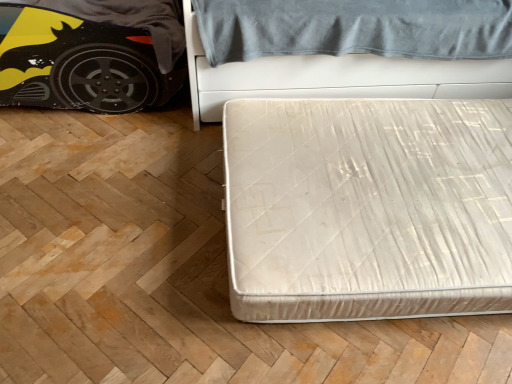
Question: Is white fabric mattress at lower right, which is the second bed in top-to-bottom order, positioned beyond the bounds of matt black car at left?

Choices:
 (A) yes
 (B) no

Answer: (A)

Question: From a real-world perspective, is white fabric mattress at lower right, acting as the 1th bed starting from the bottom, physically above matt black car at left?

Choices:
 (A) yes
 (B) no

Answer: (B)

Question: Does white fabric mattress at lower right, acting as the 1th bed starting from the bottom, have a smaller size compared to matt black car at left?

Choices:
 (A) yes
 (B) no

Answer: (A)

Question: Can you confirm if white fabric mattress at lower right, acting as the 1th bed starting from the bottom, is bigger than matt black car at left?

Choices:
 (A) no
 (B) yes

Answer: (A)

Question: Considering the relative positions of white fabric mattress at lower right, acting as the 1th bed starting from the bottom, and matt black car at left in the image provided, is white fabric mattress at lower right, acting as the 1th bed starting from the bottom, to the right of matt black car at left from the viewer's perspective?

Choices:
 (A) yes
 (B) no

Answer: (A)

Question: Can you confirm if white fabric mattress at lower right, which is the second bed in top-to-bottom order, is wider than matt black car at left?

Choices:
 (A) yes
 (B) no

Answer: (A)

Question: From the image's perspective, does matt black car at left appear lower than white textured mattress at center, acting as the second bed starting from the bottom?

Choices:
 (A) no
 (B) yes

Answer: (B)

Question: Does matt black car at left have a lesser width compared to white textured mattress at center, which is counted as the first bed, starting from the top?

Choices:
 (A) yes
 (B) no

Answer: (A)

Question: Is white textured mattress at center, acting as the second bed starting from the bottom, surrounded by matt black car at left?

Choices:
 (A) no
 (B) yes

Answer: (A)

Question: Is matt black car at left looking in the opposite direction of white textured mattress at center, acting as the second bed starting from the bottom?

Choices:
 (A) yes
 (B) no

Answer: (B)

Question: Is matt black car at left facing towards white textured mattress at center, which is counted as the first bed, starting from the top?

Choices:
 (A) no
 (B) yes

Answer: (A)

Question: Is matt black car at left located outside white textured mattress at center, acting as the second bed starting from the bottom?

Choices:
 (A) no
 (B) yes

Answer: (B)

Question: Is white textured mattress at center, acting as the second bed starting from the bottom, bigger than white fabric mattress at lower right, which is the second bed in top-to-bottom order?

Choices:
 (A) no
 (B) yes

Answer: (B)